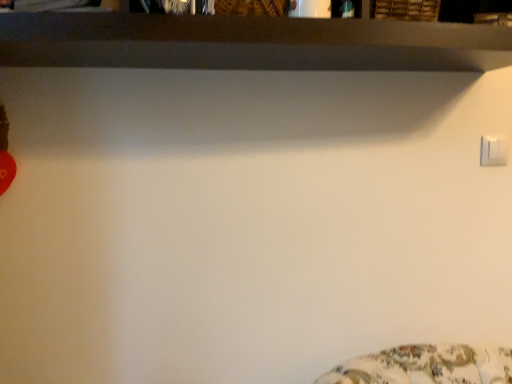
In order to face white plastic light switch at upper right, should I rotate leftwards or rightwards?

A 28.834 degree turn to the right will do.

The image size is (512, 384). What do you see at coordinates (493, 150) in the screenshot? I see `white plastic light switch at upper right` at bounding box center [493, 150].

Locate an element on the screen. Image resolution: width=512 pixels, height=384 pixels. white plastic light switch at upper right is located at coordinates (493, 150).

The height and width of the screenshot is (384, 512). I want to click on white plastic light switch at upper right, so click(x=493, y=150).